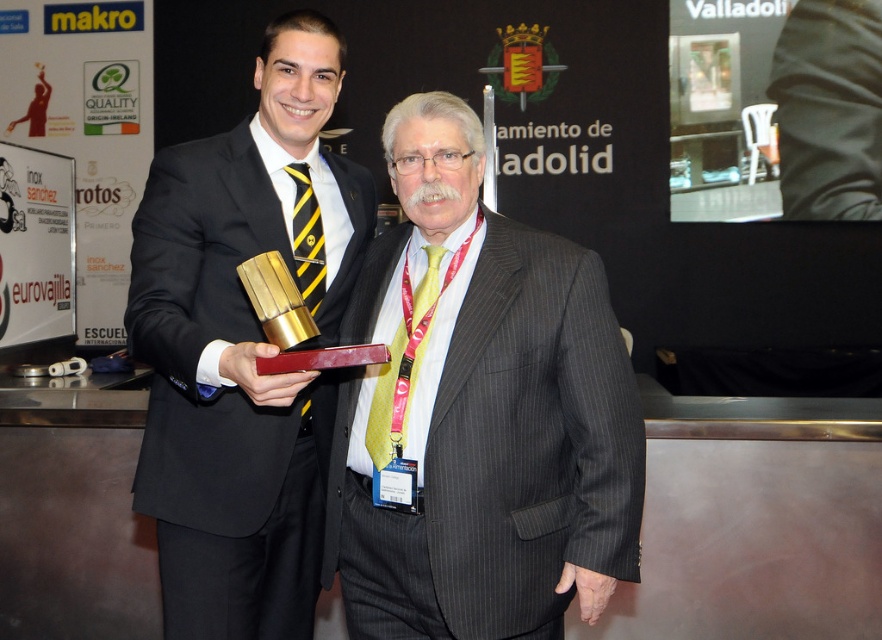
Can you confirm if matte black suit at center is shorter than yellowstriped fabrictie at center?

Incorrect, matte black suit at center's height does not fall short of yellowstriped fabrictie at center's.

Can you confirm if matte black suit at center is positioned to the left of yellowstriped fabrictie at center?

Yes, matte black suit at center is to the left of yellowstriped fabrictie at center.

Is point (326, 177) in front of point (310, 252)?

No.

At what (x,y) coordinates should I click in order to perform the action: click on matte black suit at center. Please return your answer as a coordinate pair (x, y). Looking at the image, I should click on (241, 349).

Which is above, pinstriped suit at center or yellowstriped fabrictie at center?

yellowstriped fabrictie at center is higher up.

Does pinstriped suit at center have a lesser height compared to yellowstriped fabrictie at center?

In fact, pinstriped suit at center may be taller than yellowstriped fabrictie at center.

Describe the element at coordinates (479, 412) in the screenshot. I see `pinstriped suit at center` at that location.

This screenshot has width=882, height=640. In order to click on pinstriped suit at center in this screenshot , I will do `click(479, 412)`.

Is pinstriped suit at center taller than yellow dotted tie at center?

Yes.

Which is behind, point (522, 333) or point (415, 381)?

The point (415, 381) is more distant.

The height and width of the screenshot is (640, 882). Find the location of `pinstriped suit at center`. pinstriped suit at center is located at coordinates (479, 412).